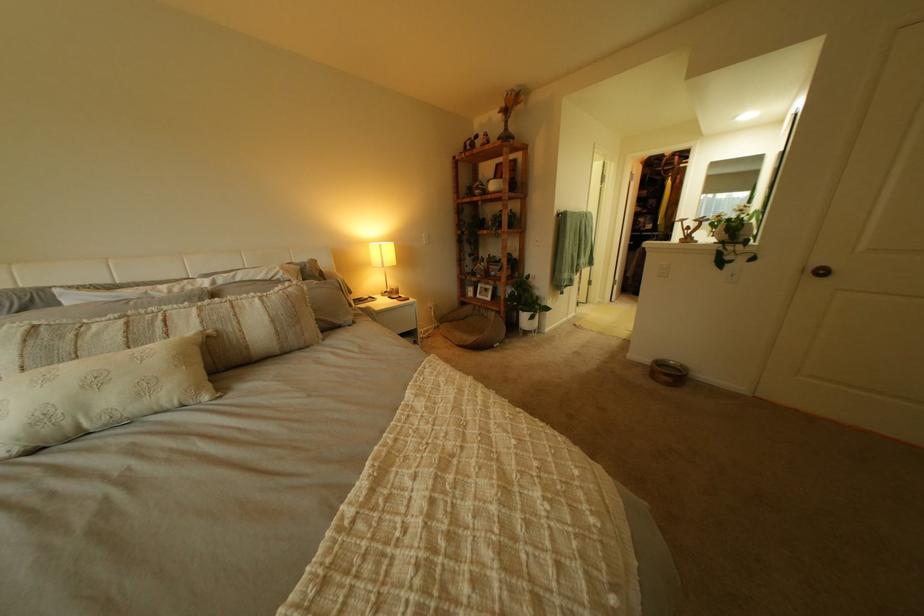
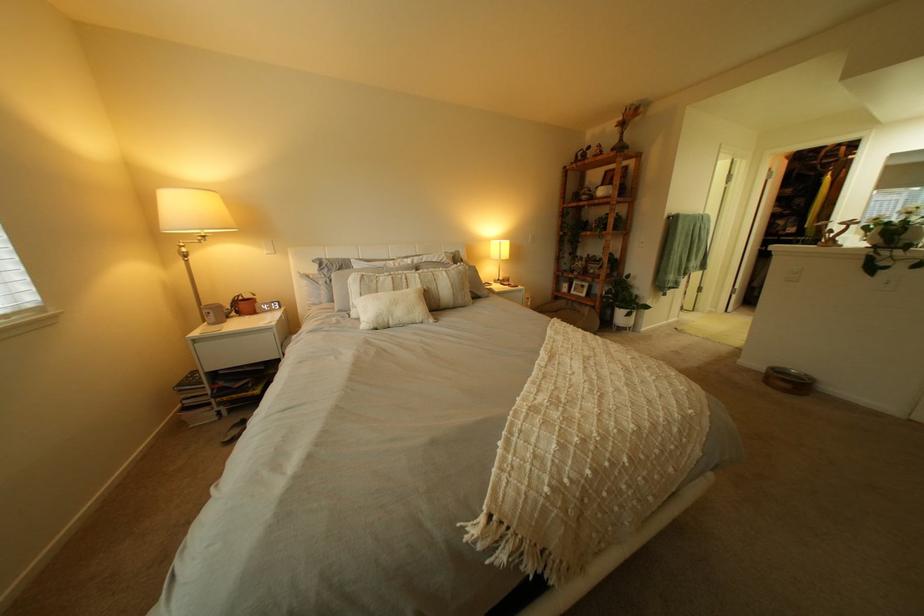
Question: I am providing you with two images of the same scene from different viewpoints. Which of the following objects are not visible in image2?

Choices:
 (A) woven throw blanket
 (B) white drawer handle
 (C) striped pillow
 (D) none of these

Answer: (D)